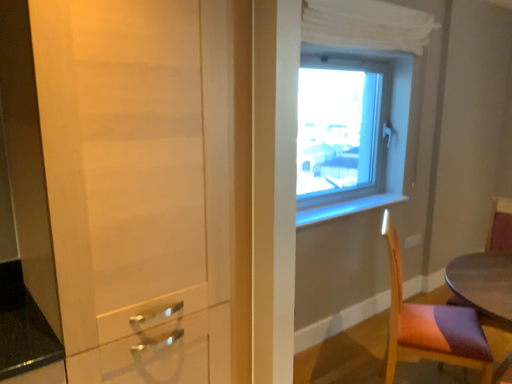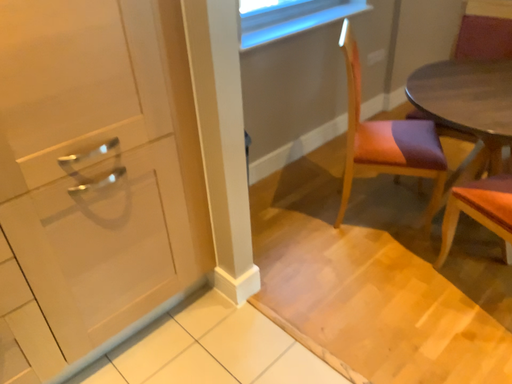
Question: How did the camera likely rotate when shooting the video?

Choices:
 (A) rotated upward
 (B) rotated downward

Answer: (B)